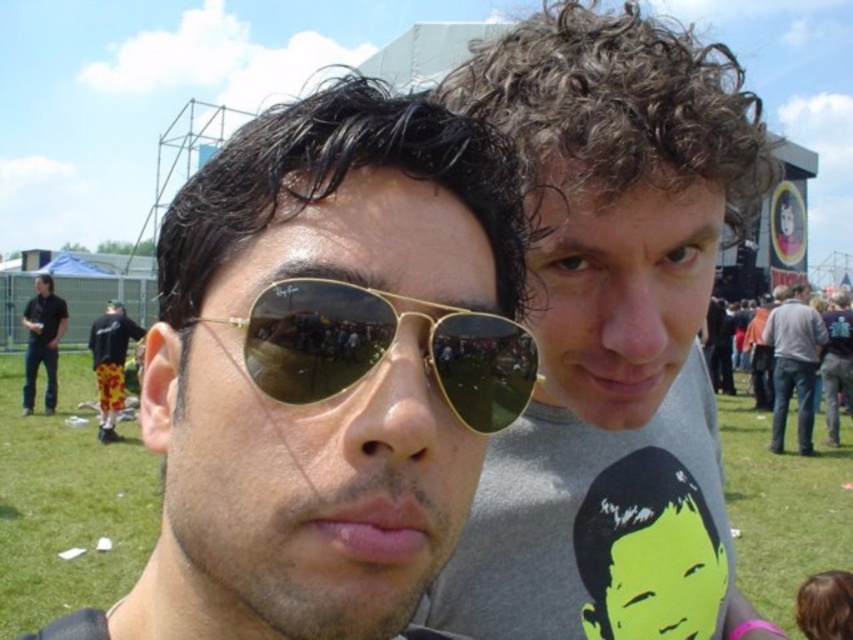
Question: Among these points, which one is farthest from the camera?

Choices:
 (A) (550, 209)
 (B) (595, 618)
 (C) (119, 314)
 (D) (56, 344)

Answer: (D)

Question: Observing the image, what is the correct spatial positioning of matte gray face at upper right in reference to gray cotton shirt at right?

Choices:
 (A) below
 (B) above

Answer: (B)

Question: Where is gold reflective aviator sunglasses at center located in relation to gray t-shirt at center in the image?

Choices:
 (A) right
 (B) left

Answer: (B)

Question: Which of these objects is positioned farthest from the dark gray shirt at left?

Choices:
 (A) gray cotton shirt at right
 (B) matte gray face at upper right

Answer: (B)

Question: Considering the real-world distances, which object is closest to the floral shorts at lower left?

Choices:
 (A) dark gray shirt at left
 (B) neon yellow face at center

Answer: (A)

Question: Does gold reflective sunglasses at center appear over matte gold sunglasses at center?

Choices:
 (A) yes
 (B) no

Answer: (B)